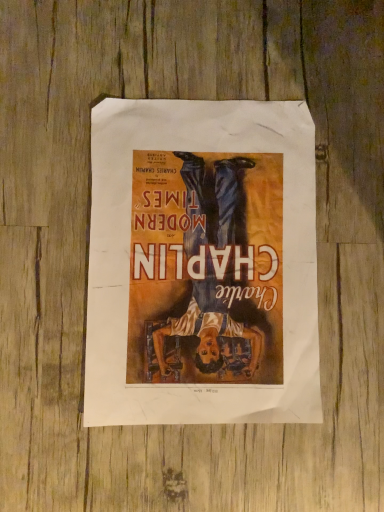
Image resolution: width=384 pixels, height=512 pixels. What are the coordinates of `blank space situated above matte paper poster at center (from a real-world perspective)` in the screenshot? It's located at pyautogui.click(x=203, y=252).